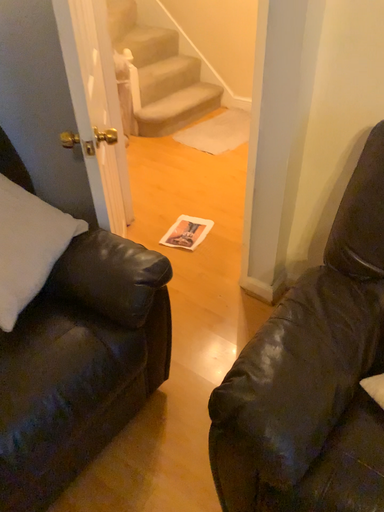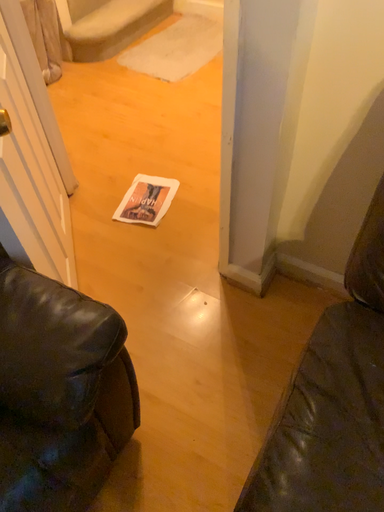
Question: Which way did the camera rotate in the video?

Choices:
 (A) rotated downward
 (B) rotated upward

Answer: (A)